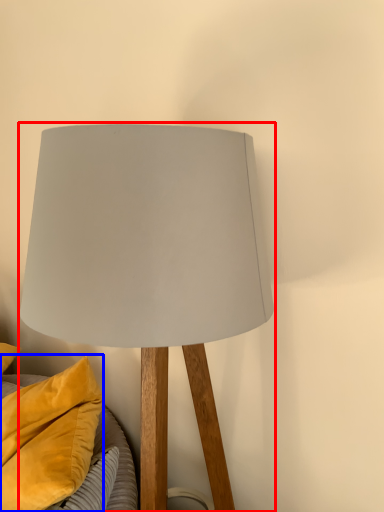
Question: Which object is closer to the camera taking this photo, lamp (highlighted by a red box) or pillow (highlighted by a blue box)?

Choices:
 (A) lamp
 (B) pillow

Answer: (A)